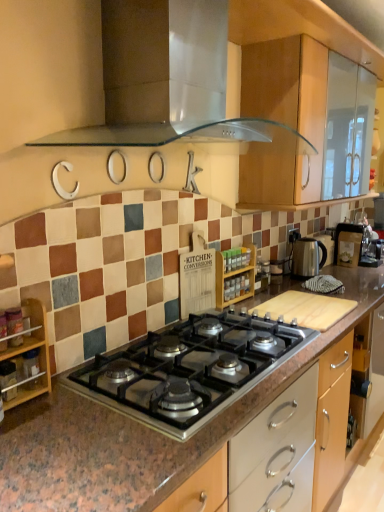
Question: Is metallic silver kettle at right, marked as the third appliance in a front-to-back arrangement, with transparent glass range hood at upper center?

Choices:
 (A) no
 (B) yes

Answer: (A)

Question: Is metallic silver kettle at right, the 2th appliance viewed from the left, to the left of transparent glass range hood at upper center from the viewer's perspective?

Choices:
 (A) no
 (B) yes

Answer: (A)

Question: Considering the relative sizes of metallic silver kettle at right, the 1th appliance positioned from the back, and transparent glass range hood at upper center in the image provided, is metallic silver kettle at right, the 1th appliance positioned from the back, thinner than transparent glass range hood at upper center?

Choices:
 (A) yes
 (B) no

Answer: (A)

Question: Does metallic silver kettle at right, which ranks as the second appliance in right-to-left order, come behind transparent glass range hood at upper center?

Choices:
 (A) no
 (B) yes

Answer: (B)

Question: Considering the relative sizes of metallic silver kettle at right, the 1th appliance positioned from the back, and transparent glass range hood at upper center in the image provided, is metallic silver kettle at right, the 1th appliance positioned from the back, smaller than transparent glass range hood at upper center?

Choices:
 (A) yes
 (B) no

Answer: (A)

Question: Considering the relative positions of black stainless steel gas stove at center and metallic silver coffee maker at right, acting as the third appliance starting from the left, in the image provided, is black stainless steel gas stove at center to the left or to the right of metallic silver coffee maker at right, acting as the third appliance starting from the left,?

Choices:
 (A) left
 (B) right

Answer: (A)

Question: Is black stainless steel gas stove at center in front of or behind metallic silver coffee maker at right, which is counted as the 1th appliance, starting from the right, in the image?

Choices:
 (A) front
 (B) behind

Answer: (A)

Question: Does point (203, 357) appear closer or farther from the camera than point (337, 230)?

Choices:
 (A) farther
 (B) closer

Answer: (B)

Question: Considering the positions of black stainless steel gas stove at center and metallic silver coffee maker at right, which is counted as the 1th appliance, starting from the right, in the image, is black stainless steel gas stove at center taller or shorter than metallic silver coffee maker at right, which is counted as the 1th appliance, starting from the right,?

Choices:
 (A) short
 (B) tall

Answer: (A)

Question: From the image's perspective, is silver metallic kettle at right above or below transparent glass range hood at upper center?

Choices:
 (A) below
 (B) above

Answer: (A)

Question: Is silver metallic kettle at right to the left or to the right of transparent glass range hood at upper center in the image?

Choices:
 (A) left
 (B) right

Answer: (B)

Question: From a real-world perspective, relative to transparent glass range hood at upper center, is silver metallic kettle at right vertically above or below?

Choices:
 (A) above
 (B) below

Answer: (B)

Question: Based on their sizes in the image, would you say silver metallic kettle at right is bigger or smaller than transparent glass range hood at upper center?

Choices:
 (A) small
 (B) big

Answer: (A)

Question: Looking at their shapes, would you say transparent glass range hood at upper center is wider or thinner than wooden shelf at left?

Choices:
 (A) thin
 (B) wide

Answer: (B)

Question: Considering the positions of point (137, 135) and point (13, 359), is point (137, 135) closer or farther from the camera than point (13, 359)?

Choices:
 (A) farther
 (B) closer

Answer: (A)